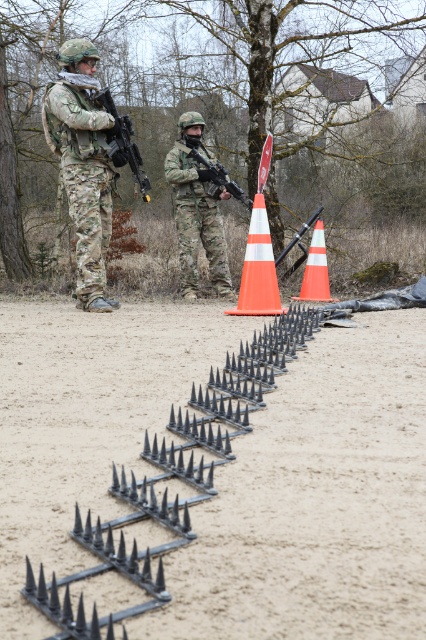
Does orange/white traffic cone at center appear over matte black rifle at upper left?

No, orange/white traffic cone at center is not above matte black rifle at upper left.

Is orange/white traffic cone at center to the left of matte black rifle at upper left from the viewer's perspective?

In fact, orange/white traffic cone at center is to the right of matte black rifle at upper left.

Is point (308, 296) closer to camera compared to point (118, 147)?

No, (308, 296) is behind (118, 147).

The width and height of the screenshot is (426, 640). What are the coordinates of `orange/white traffic cone at center` in the screenshot? It's located at (316, 268).

Between camouflage fabric uniform at left and matte black rifle at upper left, which one has more height?

Standing taller between the two is camouflage fabric uniform at left.

This screenshot has height=640, width=426. What do you see at coordinates (83, 163) in the screenshot? I see `camouflage fabric uniform at left` at bounding box center [83, 163].

This screenshot has height=640, width=426. I want to click on camouflage fabric uniform at left, so click(x=83, y=163).

Image resolution: width=426 pixels, height=640 pixels. Describe the element at coordinates (124, 141) in the screenshot. I see `matte black rifle at upper left` at that location.

Is point (134, 160) farther from viewer compared to point (213, 168)?

That is False.

Does point (120, 129) come behind point (241, 188)?

No.

Locate an element on the screen. matte black rifle at upper left is located at coordinates (124, 141).